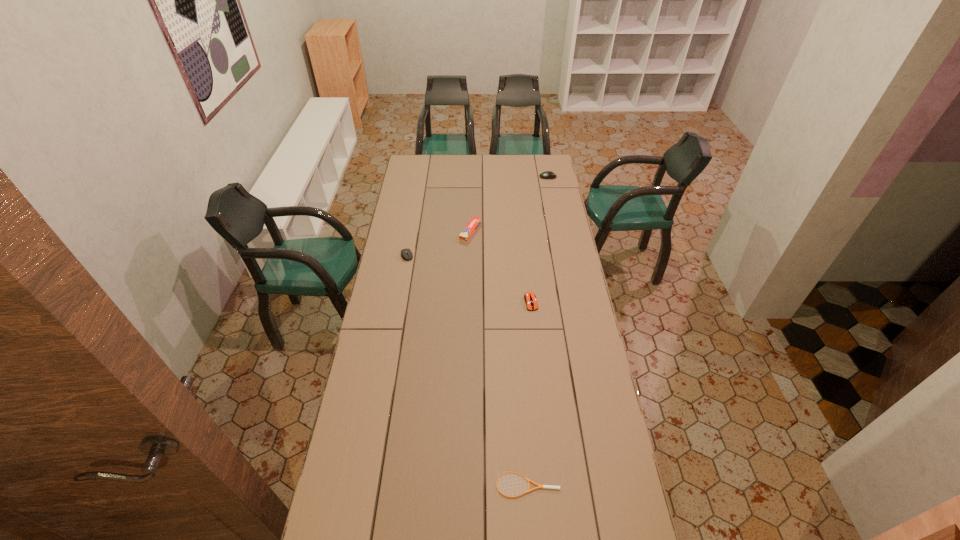
You are a GUI agent. You are given a task and a screenshot of the screen. Output one action in this format:
    pyautogui.click(x=<x>, y=<y>)
    Task: Click on the free space between the toothpaste and the second computer mouse from left to right
    The width and height of the screenshot is (960, 540).
    Given the screenshot: What is the action you would take?
    pyautogui.click(x=501, y=267)

Find the location of a particular element. The image size is (960, 540). unoccupied area between the toothpaste and the shortest object is located at coordinates (499, 358).

Where is `vacant area between the farthest object and the fourth nearest object`? vacant area between the farthest object and the fourth nearest object is located at coordinates (509, 204).

Locate an element on the screen. The height and width of the screenshot is (540, 960). empty space between the leftmost object and the second nearest object is located at coordinates (468, 279).

Locate an element on the screen. The width and height of the screenshot is (960, 540). free spot between the second computer mouse from right to left and the leftmost object is located at coordinates (468, 279).

Locate an element on the screen. Image resolution: width=960 pixels, height=540 pixels. object that stands as the fourth closest to the rightmost object is located at coordinates (539, 486).

I want to click on object that ranks as the closest to the second nearest object, so click(468, 231).

Find the location of `the second closest computer mouse to the shortest object`. the second closest computer mouse to the shortest object is located at coordinates (404, 252).

Find the location of `computer mouse object that ranks as the second closest to the third farthest object`. computer mouse object that ranks as the second closest to the third farthest object is located at coordinates (548, 174).

At what (x,y) coordinates should I click in order to perform the action: click on free space that satisfies the following two spatial constraints: 1. on the front side of the fourth nearest object; 2. on the left side of the second nearest object. Please return your answer as a coordinate pair (x, y). Looking at the image, I should click on point(468,302).